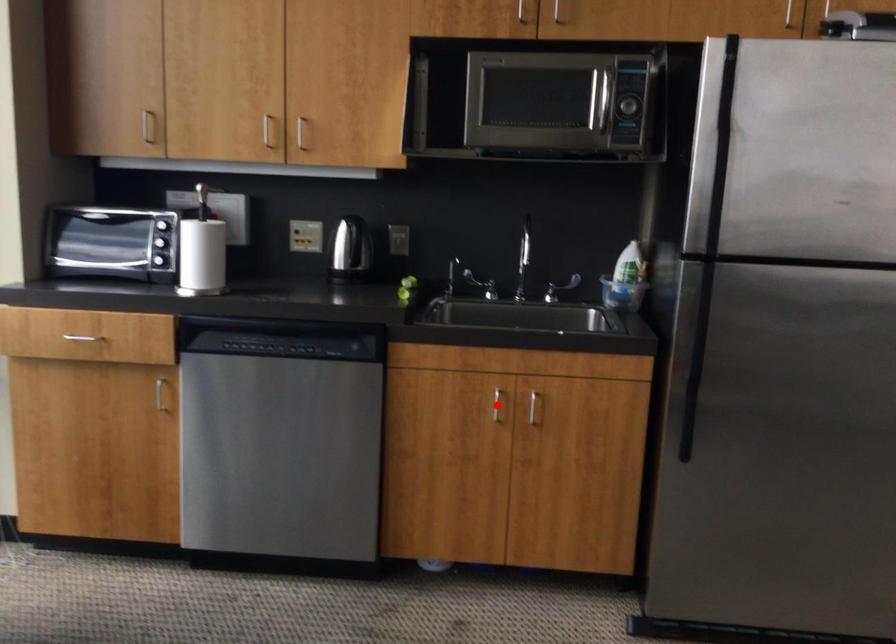
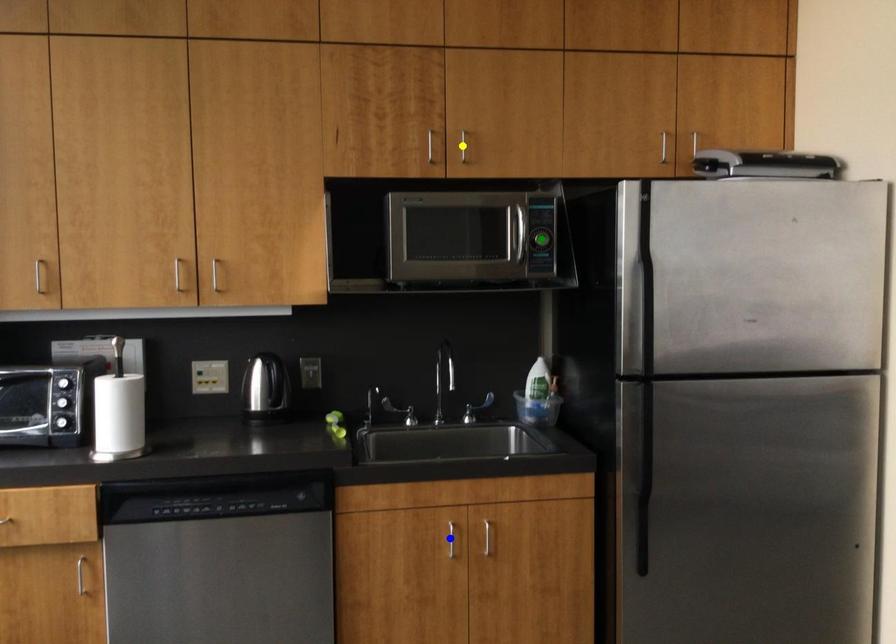
Question: I am providing you with two images of the same scene from different viewpoints. A red point is marked on the first image. You are given multiple points on the second image. Which point in image 2 represents the same 3d spot as the red point in image 1?

Choices:
 (A) yellow point
 (B) blue point
 (C) green point

Answer: (B)